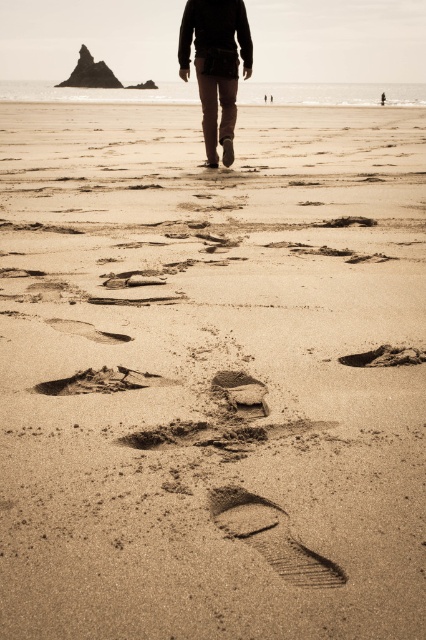
You are standing on the beach and see two points marked on the sand. The first point is at coordinates point (305, 568) and the second is at point (350, 360). If you want to walk towards the horizon, which point should you step on first to stay closer to the path leading away from the camera?

You should step on point (305, 568) first because it is in front of point (350, 360), meaning it is closer to the direction of the horizon.

You are standing on the beach and see the matte brown pants at center and the dark brown textured sand at center. Which object is closer to you?

The matte brown pants at center are closer to you because they are located above the dark brown textured sand at center, indicating they are positioned higher in the visual hierarchy and thus nearer in the scene.

You are standing on the beach and see the matte brown pants at center and the dark brown sand at center. Which object is closer to your viewpoint?

The matte brown pants at center is located above dark brown sand at center, so it is closer to your viewpoint.